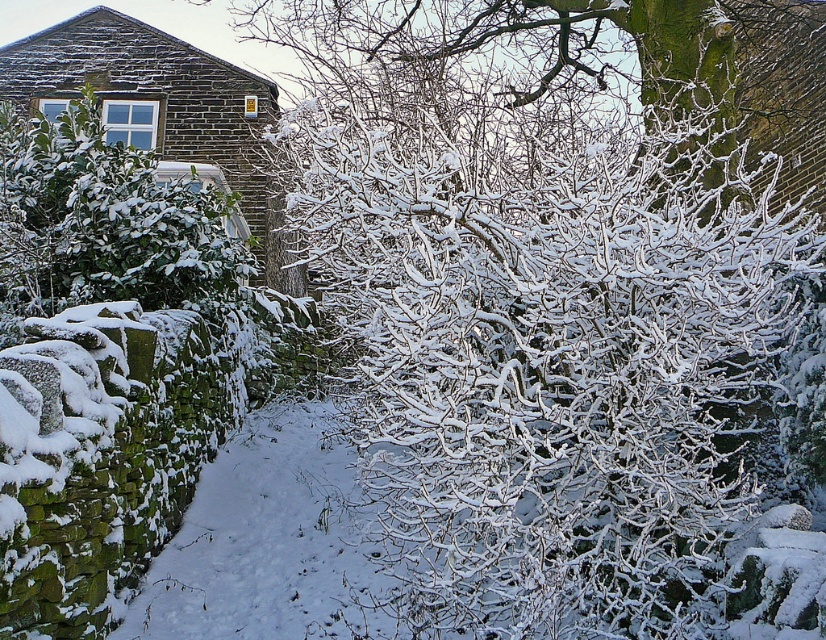
Is green leafy bush at upper left positioned behind snow-covered branches at upper center?

No.

Which is more to the left, green leafy bush at upper left or snow-covered branches at upper center?

From the viewer's perspective, green leafy bush at upper left appears more on the left side.

Which is in front, point (88, 182) or point (805, 122)?

Point (88, 182) is more forward.

I want to click on green leafy bush at upper left, so click(x=102, y=221).